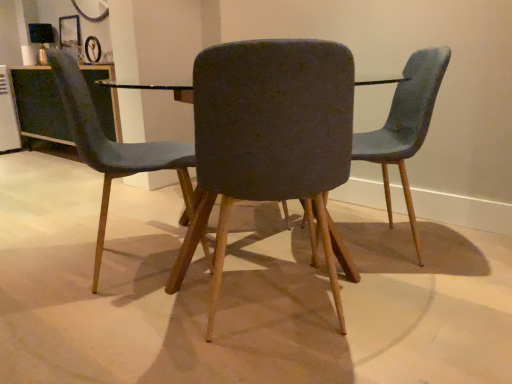
Locate an element on the screen. vacant position to the left of matte black table at center is located at coordinates (73, 245).